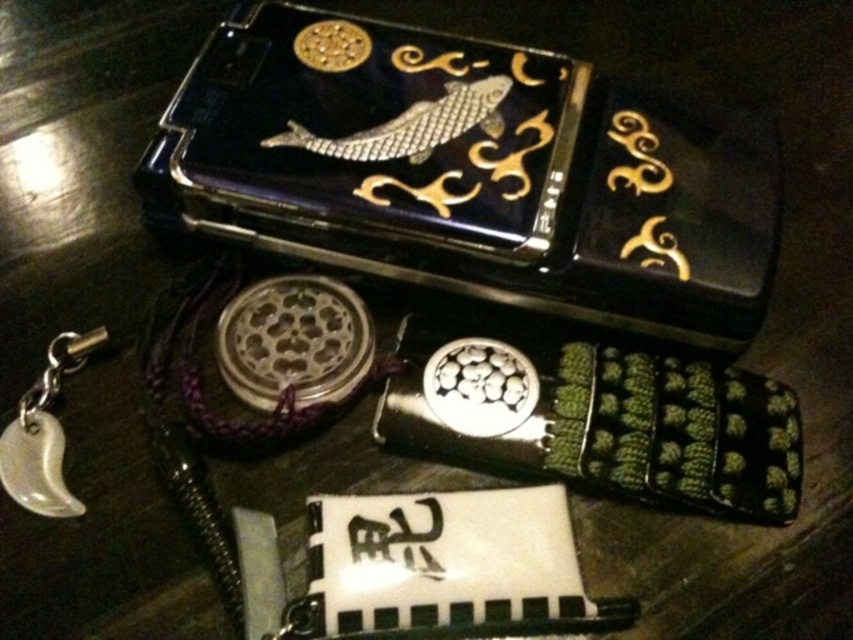
What object is located at the coordinates point (473, 172)?

The point (473, 172) corresponds to the black lacquer box at upper center.

You are organizing items on a dark wooden desk. You have a black lacquer box at upper center and a white porcelain pocket watch at lower left. Where should you place a new item so it is between them?

Place the new item between the black lacquer box at upper center and the white porcelain pocket watch at lower left, positioning it to the right of the pocket watch and to the left of the lacquer box since the box is to the right of the watch.

You are organizing items on a desk and need to stack the black lacquer box at upper center and the white porcelain pocket watch at lower left. Can you place the taller item on top of the shorter one without it falling over?

The black lacquer box at upper center is much taller than the white porcelain pocket watch at lower left. Since the taller item is placed on top, it might be less stable and more likely to fall over. It is advisable to place the shorter white porcelain pocket watch at lower left on top for better stability.